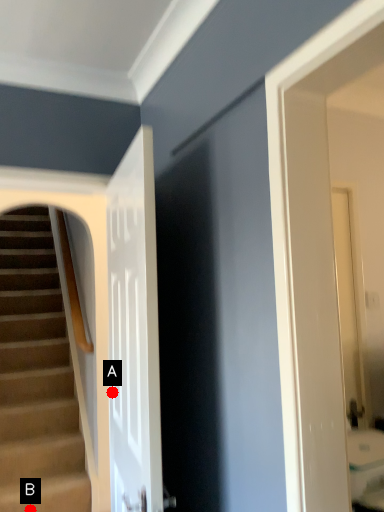
Question: Two points are circled on the image, labeled by A and B beside each circle. Which point is closer to the camera?

Choices:
 (A) A is closer
 (B) B is closer

Answer: (A)